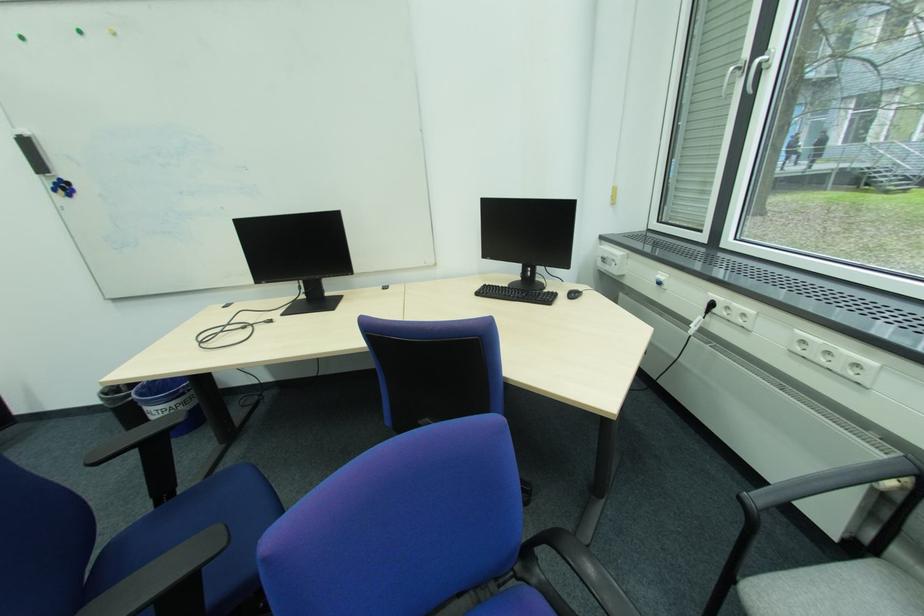
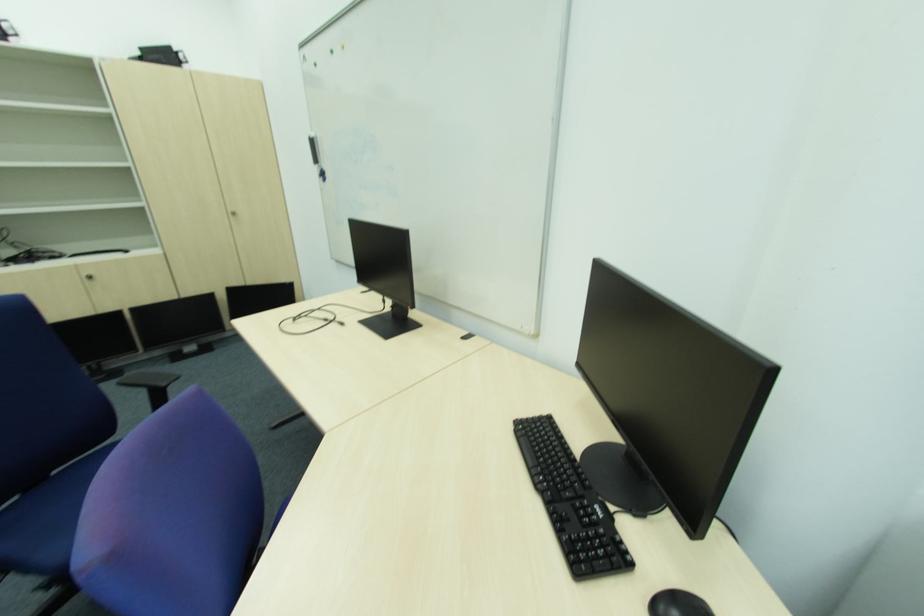
In the second image, find the point that corresponds to pixel 578 297 in the first image.

(669, 610)